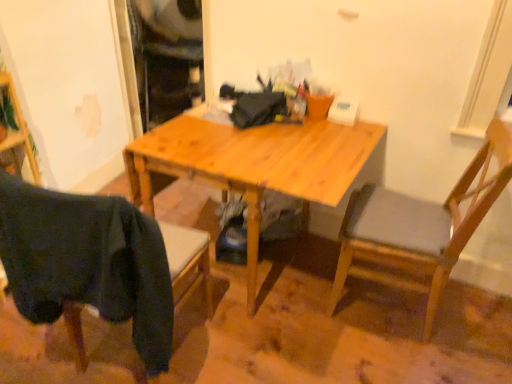
Question: Considering the relative positions of dark fabric chair at lower left, which ranks as the 2th chair in right-to-left order, and light wood desk at center in the image provided, is dark fabric chair at lower left, which ranks as the 2th chair in right-to-left order, to the right of light wood desk at center from the viewer's perspective?

Choices:
 (A) yes
 (B) no

Answer: (B)

Question: Is dark fabric chair at lower left, which ranks as the 2th chair in right-to-left order, positioned with its back to light wood desk at center?

Choices:
 (A) no
 (B) yes

Answer: (A)

Question: Considering the relative sizes of dark fabric chair at lower left, which ranks as the 2th chair in right-to-left order, and light wood desk at center in the image provided, is dark fabric chair at lower left, which ranks as the 2th chair in right-to-left order, taller than light wood desk at center?

Choices:
 (A) no
 (B) yes

Answer: (A)

Question: From a real-world perspective, is dark fabric chair at lower left, which is the 1th chair in left-to-right order, physically above light wood desk at center?

Choices:
 (A) no
 (B) yes

Answer: (B)

Question: Considering the relative sizes of dark fabric chair at lower left, which ranks as the 2th chair in right-to-left order, and light wood desk at center in the image provided, is dark fabric chair at lower left, which ranks as the 2th chair in right-to-left order, smaller than light wood desk at center?

Choices:
 (A) yes
 (B) no

Answer: (A)

Question: Is dark fabric chair at lower left, which is the 1th chair in left-to-right order, far from light wood desk at center?

Choices:
 (A) yes
 (B) no

Answer: (B)

Question: Is dark fabric chair at lower left, which ranks as the 2th chair in right-to-left order, bigger than wooden chair at right, the 2th chair in the left-to-right sequence?

Choices:
 (A) yes
 (B) no

Answer: (B)

Question: Is dark fabric chair at lower left, which ranks as the 2th chair in right-to-left order, smaller than wooden chair at right, the first chair in the right-to-left sequence?

Choices:
 (A) no
 (B) yes

Answer: (B)

Question: Is dark fabric chair at lower left, which is the 1th chair in left-to-right order, further to the viewer compared to wooden chair at right, the first chair in the right-to-left sequence?

Choices:
 (A) no
 (B) yes

Answer: (A)

Question: From the image's perspective, is dark fabric chair at lower left, which is the 1th chair in left-to-right order, below wooden chair at right, the 2th chair in the left-to-right sequence?

Choices:
 (A) no
 (B) yes

Answer: (B)

Question: Is wooden chair at right, the 2th chair in the left-to-right sequence, inside dark fabric chair at lower left, which is the 1th chair in left-to-right order?

Choices:
 (A) yes
 (B) no

Answer: (B)

Question: Does dark fabric chair at lower left, which is the 1th chair in left-to-right order, appear on the right side of wooden chair at right, the first chair in the right-to-left sequence?

Choices:
 (A) no
 (B) yes

Answer: (A)

Question: Is wooden chair at right, the first chair in the right-to-left sequence, at the right side of dark fabric chair at lower left, which ranks as the 2th chair in right-to-left order?

Choices:
 (A) yes
 (B) no

Answer: (A)